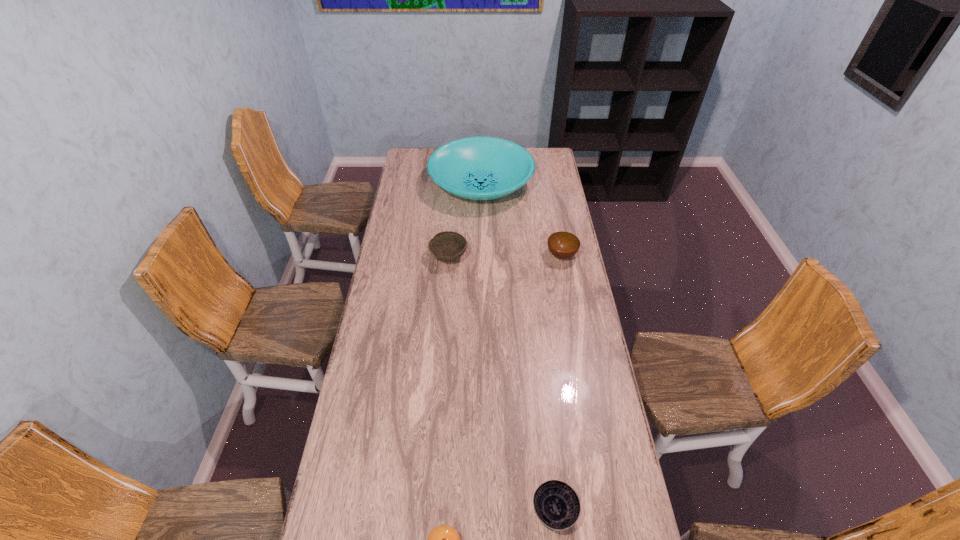
The width and height of the screenshot is (960, 540). Identify the location of object situated at the far edge. pos(478,168).

This screenshot has height=540, width=960. Find the location of `object positioned at the left edge`. object positioned at the left edge is located at coordinates (478, 168).

In order to click on dish situated at the right edge in this screenshot , I will do `click(478, 168)`.

Find the location of `object at the far left corner`. object at the far left corner is located at coordinates (478, 168).

This screenshot has width=960, height=540. I want to click on object that is positioned at the far right corner, so click(x=478, y=168).

Find the location of a particular element. This screenshot has height=540, width=960. free space at the left edge of the desktop is located at coordinates point(386,261).

You are a GUI agent. You are given a task and a screenshot of the screen. Output one action in this format:
    pyautogui.click(x=<x>, y=<y>)
    Task: Click on the blank area at the right edge
    
    Given the screenshot: What is the action you would take?
    coord(559,327)

The image size is (960, 540). I want to click on blank space at the far right corner, so click(x=536, y=151).

Where is `blank region between the leftmost bowl and the shortest bowl`? The width and height of the screenshot is (960, 540). blank region between the leftmost bowl and the shortest bowl is located at coordinates (501, 384).

You are a GUI agent. You are given a task and a screenshot of the screen. Output one action in this format:
    pyautogui.click(x=<x>, y=<y>)
    Task: Click on the free space between the leftmost bowl and the farthest object
    This screenshot has width=960, height=540.
    Given the screenshot: What is the action you would take?
    pyautogui.click(x=465, y=221)